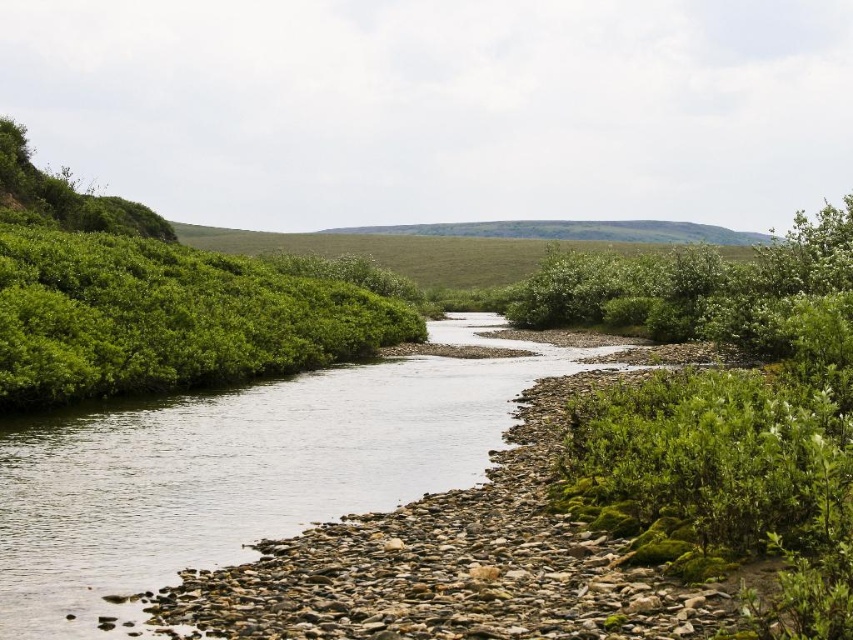
Question: Which object appears farthest from the camera in this image?

Choices:
 (A) clear water at center
 (B) green leafy shrubs at left

Answer: (B)

Question: Can you confirm if clear water at center is positioned to the right of green leafy shrubs at left?

Choices:
 (A) yes
 (B) no

Answer: (A)

Question: In this image, where is clear water at center located relative to green leafy shrubs at left?

Choices:
 (A) left
 (B) right

Answer: (B)

Question: Is clear water at center to the right of green leafy shrubs at left from the viewer's perspective?

Choices:
 (A) no
 (B) yes

Answer: (B)

Question: Which of the following is the closest to the observer?

Choices:
 (A) (16, 156)
 (B) (260, 524)

Answer: (B)

Question: Among these objects, which one is farthest from the camera?

Choices:
 (A) clear water at center
 (B) green leafy shrubs at left

Answer: (B)